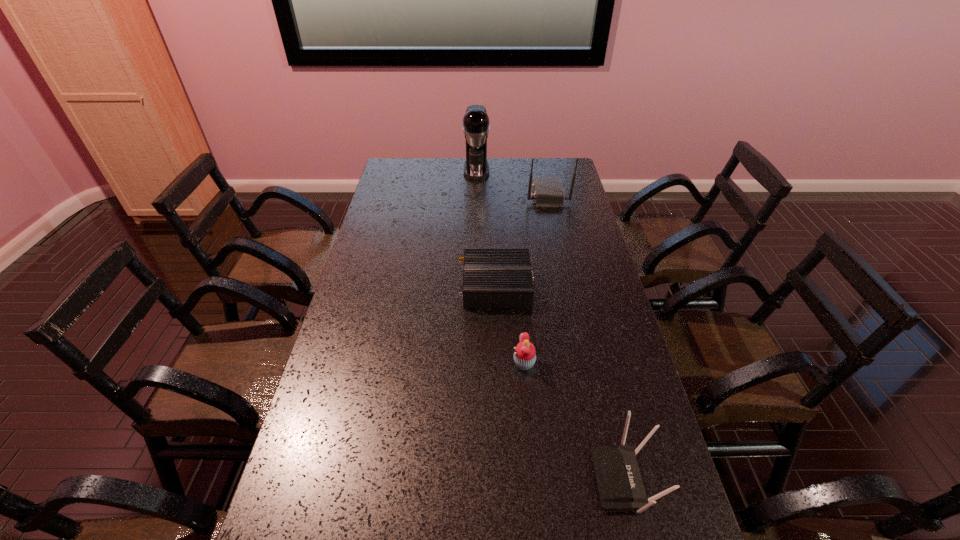
Where is `vacant space located 0.240m place cup under the spout of the coffee maker`? Image resolution: width=960 pixels, height=540 pixels. vacant space located 0.240m place cup under the spout of the coffee maker is located at coordinates (476, 211).

You are a GUI agent. You are given a task and a screenshot of the screen. Output one action in this format:
    pyautogui.click(x=<x>, y=<y>)
    Task: Click on the free location located on the back of the farthest router to connect cables
    
    Given the screenshot: What is the action you would take?
    pyautogui.click(x=468, y=195)

Image resolution: width=960 pixels, height=540 pixels. I want to click on vacant space located 0.100m on the back of the farthest router to connect cables, so click(503, 195).

Image resolution: width=960 pixels, height=540 pixels. In order to click on free space located 0.300m on the back of the farthest router to connect cables in this screenshot , I will do click(x=457, y=195).

Identify the location of vacant area located on the front-facing side of the third tallest object. (568, 478).

Find the location of a particular element. Image resolution: width=960 pixels, height=540 pixels. vacant space located on the front-facing side of the third tallest object is located at coordinates (420, 478).

This screenshot has width=960, height=540. I want to click on blank area located on the front-facing side of the third tallest object, so click(498, 478).

Locate an element on the screen. This screenshot has width=960, height=540. vacant region located on the face of the fourth farthest object is located at coordinates (403, 363).

I want to click on vacant space positioned on the face of the fourth farthest object, so click(386, 363).

This screenshot has height=540, width=960. What are the coordinates of `free space located 0.180m on the face of the fourth farthest object` in the screenshot? It's located at (449, 363).